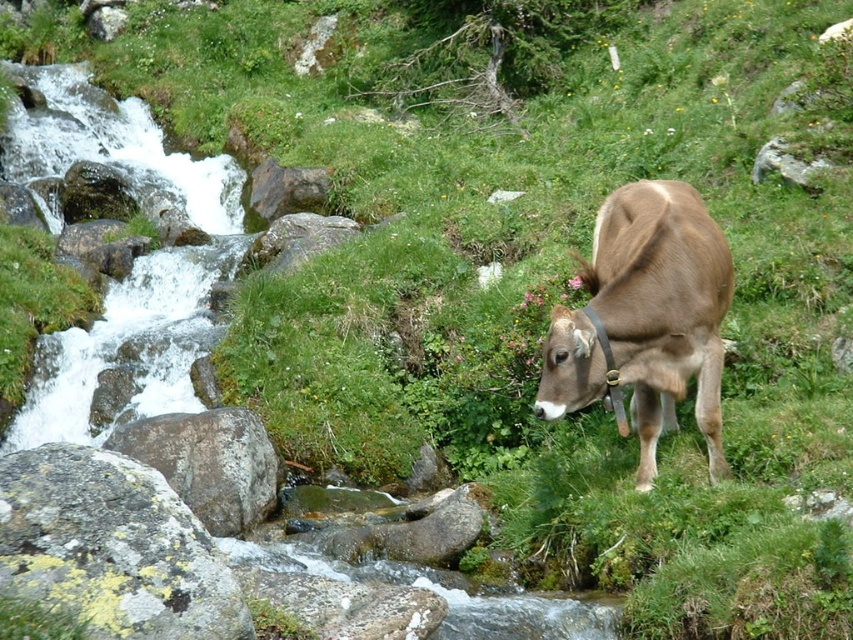
Who is positioned more to the right, speckled gray rock at left or gray rock at upper right?

gray rock at upper right is more to the right.

Which is below, speckled gray rock at left or gray rock at upper right?

speckled gray rock at left

The width and height of the screenshot is (853, 640). I want to click on speckled gray rock at left, so click(x=112, y=547).

Is speckled gray rock at left to the right of gray rough rock at lower left from the viewer's perspective?

Yes, speckled gray rock at left is to the right of gray rough rock at lower left.

Which is in front, point (57, 513) or point (241, 417)?

Point (57, 513)

I want to click on speckled gray rock at left, so 112,547.

Does gray rough rock at lower left have a greater height compared to gray rock at upper right?

Correct, gray rough rock at lower left is much taller as gray rock at upper right.

Who is more forward, (257, 472) or (815, 164)?

Point (257, 472) is in front.

Identify the location of gray rough rock at lower left. The height and width of the screenshot is (640, 853). (209, 464).